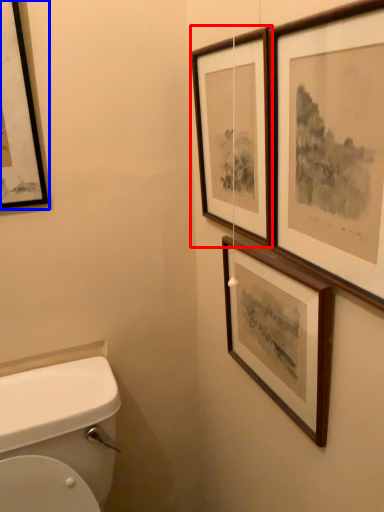
Question: Which object appears farthest to the camera in this image, picture frame (highlighted by a red box) or picture frame (highlighted by a blue box)?

Choices:
 (A) picture frame
 (B) picture frame

Answer: (B)